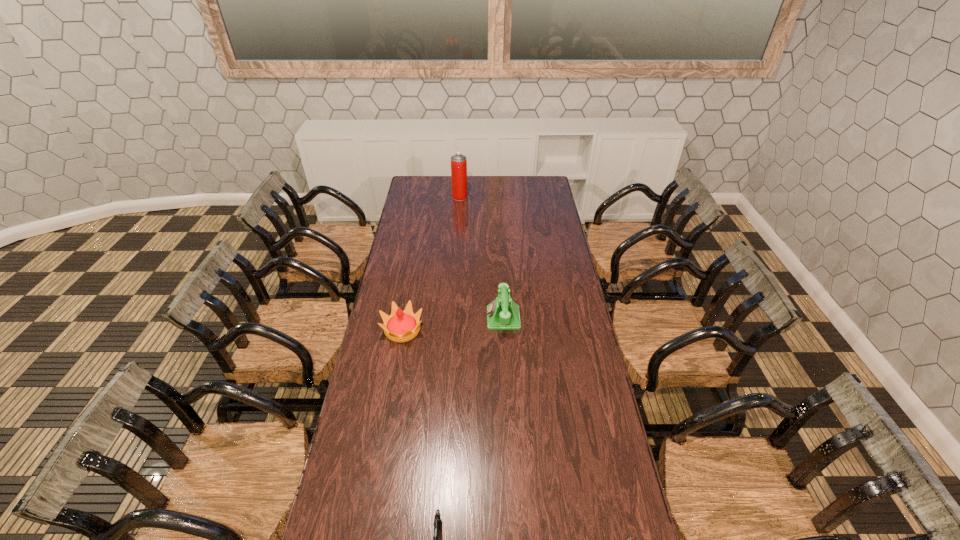
You are a GUI agent. You are given a task and a screenshot of the screen. Output one action in this format:
    pyautogui.click(x=<x>, y=<y>)
    Task: Click on the aerosol can
    Image resolution: width=960 pixels, height=540 pixels.
    Given the screenshot: What is the action you would take?
    pyautogui.click(x=458, y=162)

At what (x,y) coordinates should I click in order to perform the action: click on the farthest object. Please return your answer as a coordinate pair (x, y). The image size is (960, 540). Looking at the image, I should click on (458, 162).

Identify the location of telephone. This screenshot has height=540, width=960. (503, 313).

This screenshot has width=960, height=540. Find the location of `the leftmost object`. the leftmost object is located at coordinates (401, 326).

Find the location of `vacant space situated 0.220m on the back of the farthest object`. vacant space situated 0.220m on the back of the farthest object is located at coordinates (462, 176).

The height and width of the screenshot is (540, 960). Identify the location of vacant space located 0.300m on the dial of the telephone. (417, 318).

You are a GUI agent. You are given a task and a screenshot of the screen. Output one action in this format:
    pyautogui.click(x=<x>, y=<y>)
    Task: Click on the vacant space positioned 0.180m on the dial of the telephone
    This screenshot has width=960, height=540.
    Given the screenshot: What is the action you would take?
    pos(444,318)

Locate an element on the screen. The height and width of the screenshot is (540, 960). blank space located 0.310m on the dial of the telephone is located at coordinates (415, 318).

Find the location of a particular element. This screenshot has height=540, width=960. vacant region located on the right of the leftmost object is located at coordinates (493, 330).

Locate an element on the screen. This screenshot has width=960, height=540. object that is at the far edge is located at coordinates pyautogui.click(x=458, y=162).